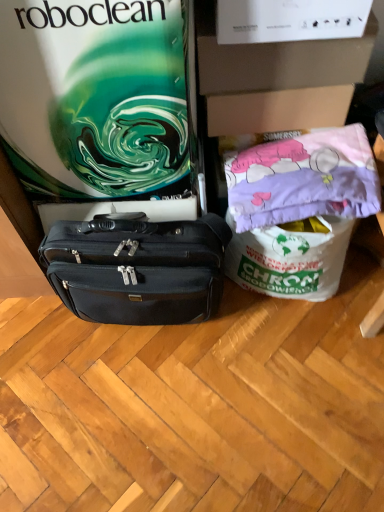
Question: Can you confirm if pink fabric pillow at upper right is bigger than matte green swirl at upper left?

Choices:
 (A) yes
 (B) no

Answer: (B)

Question: Are pink fabric pillow at upper right and matte green swirl at upper left making contact?

Choices:
 (A) yes
 (B) no

Answer: (B)

Question: Can you confirm if pink fabric pillow at upper right is positioned to the left of matte green swirl at upper left?

Choices:
 (A) yes
 (B) no

Answer: (B)

Question: Is pink fabric pillow at upper right positioned with its back to matte green swirl at upper left?

Choices:
 (A) no
 (B) yes

Answer: (A)

Question: Can you confirm if pink fabric pillow at upper right is thinner than matte green swirl at upper left?

Choices:
 (A) yes
 (B) no

Answer: (A)

Question: Does pink fabric pillow at upper right appear on the right side of matte green swirl at upper left?

Choices:
 (A) yes
 (B) no

Answer: (A)

Question: From a real-world perspective, is pink fabric pillow at upper right on white cardboard box at upper center?

Choices:
 (A) no
 (B) yes

Answer: (A)

Question: Can you confirm if pink fabric pillow at upper right is shorter than white cardboard box at upper center?

Choices:
 (A) yes
 (B) no

Answer: (A)

Question: Can you confirm if pink fabric pillow at upper right is thinner than white cardboard box at upper center?

Choices:
 (A) yes
 (B) no

Answer: (A)

Question: From the image's perspective, is pink fabric pillow at upper right located beneath white cardboard box at upper center?

Choices:
 (A) no
 (B) yes

Answer: (B)

Question: Is pink fabric pillow at upper right in front of white cardboard box at upper center?

Choices:
 (A) no
 (B) yes

Answer: (B)

Question: From the image's perspective, is pink fabric pillow at upper right over white cardboard box at upper center?

Choices:
 (A) no
 (B) yes

Answer: (A)

Question: Is pink fabric pillow at upper right completely or partially outside of black leather briefcase at center?

Choices:
 (A) no
 (B) yes

Answer: (B)